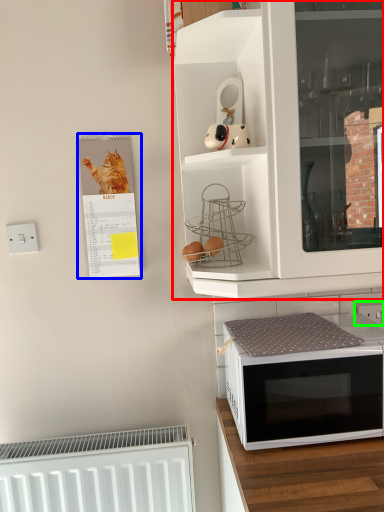
Question: Which is farther away from cabinetry (highlighted by a red box)? bulletin board (highlighted by a blue box) or electric outlet (highlighted by a green box)?

Choices:
 (A) bulletin board
 (B) electric outlet

Answer: (B)